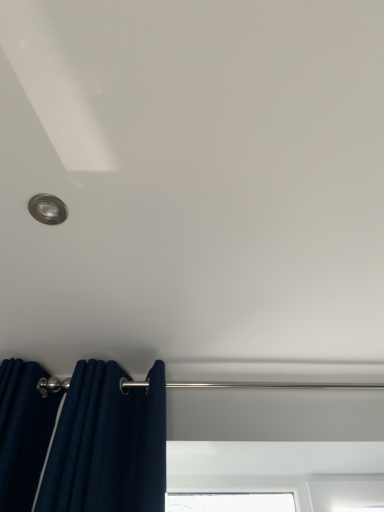
What is the approximate width of matte silver droplight at upper left?

matte silver droplight at upper left is 8.55 centimeters in width.

What do you see at coordinates (48, 209) in the screenshot? I see `matte silver droplight at upper left` at bounding box center [48, 209].

Where is `matte silver droplight at upper left`? This screenshot has width=384, height=512. matte silver droplight at upper left is located at coordinates (48, 209).

Measure the distance between point (38,199) and camera.

Point (38,199) and camera are 37.05 inches apart.

Image resolution: width=384 pixels, height=512 pixels. What are the coordinates of `matte silver droplight at upper left` in the screenshot? It's located at (48, 209).